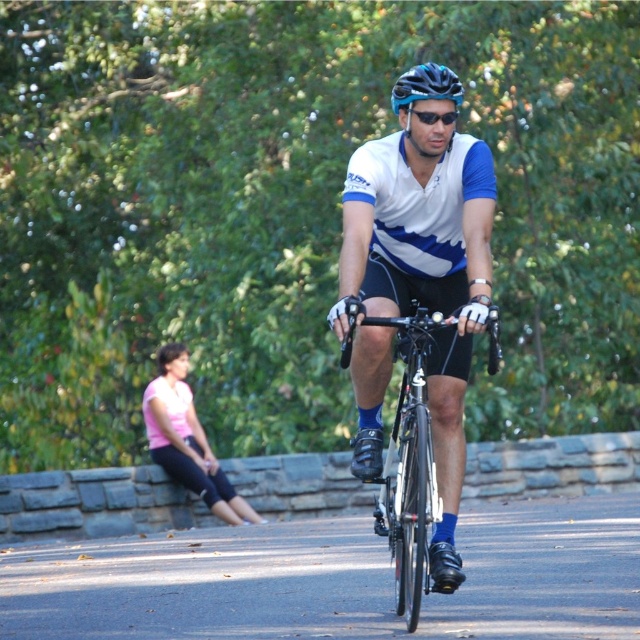
Question: Can you confirm if pink fabric shirt at lower left is positioned below matte blue bicycle helmet at center?

Choices:
 (A) no
 (B) yes

Answer: (B)

Question: Which point appears farthest from the camera in this image?

Choices:
 (A) (417, 109)
 (B) (355, 474)
 (C) (397, 112)
 (D) (220, 483)

Answer: (D)

Question: From the image, what is the correct spatial relationship of pink fabric shirt at lower left in relation to matte blue bicycle helmet at center?

Choices:
 (A) below
 (B) above

Answer: (A)

Question: From the image, what is the correct spatial relationship of white/blue jersey at center in relation to black matte sunglasses at center?

Choices:
 (A) right
 (B) left

Answer: (B)

Question: Estimate the real-world distances between objects in this image. Which object is farther from the pink fabric shirt at lower left?

Choices:
 (A) white/blue jersey at center
 (B) matte blue bicycle helmet at center

Answer: (A)

Question: Estimate the real-world distances between objects in this image. Which object is farther from the white/blue jersey at center?

Choices:
 (A) pink fabric shirt at lower left
 (B) black matte sunglasses at center

Answer: (A)